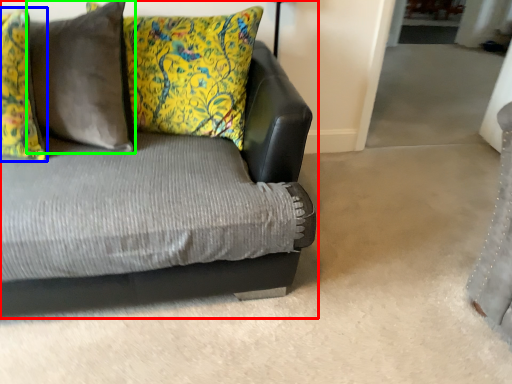
Question: Which object is the closest to the studio couch (highlighted by a red box)? Choose among these: pillow (highlighted by a blue box) or pillow (highlighted by a green box).

Choices:
 (A) pillow
 (B) pillow

Answer: (A)